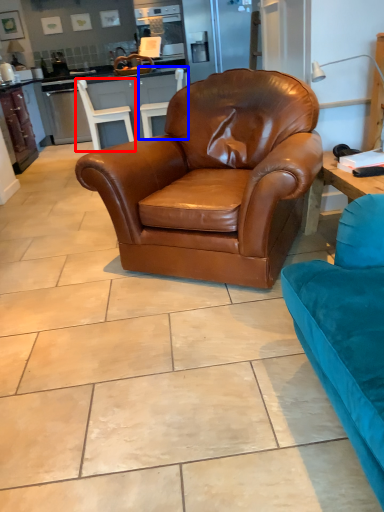
Question: Which of the following is the closest to the observer, chair (highlighted by a red box) or chair (highlighted by a blue box)?

Choices:
 (A) chair
 (B) chair

Answer: (A)